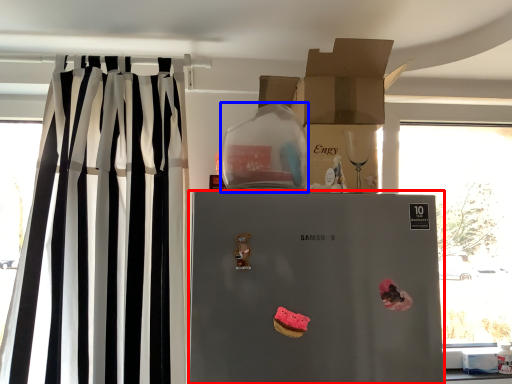
Question: Which object is further to the camera taking this photo, refrigerator (highlighted by a red box) or appliance (highlighted by a blue box)?

Choices:
 (A) refrigerator
 (B) appliance

Answer: (B)